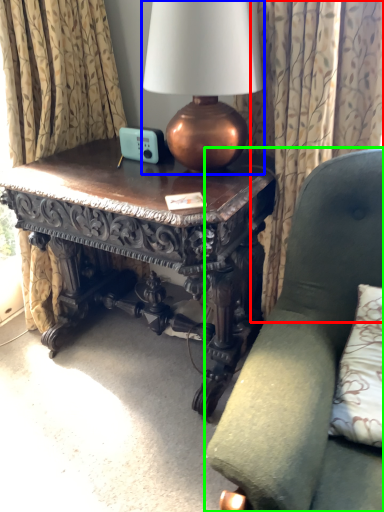
Question: Estimate the real-world distances between objects in this image. Which object is closer to curtain (highlighted by a red box), lamp (highlighted by a blue box) or chair (highlighted by a green box)?

Choices:
 (A) lamp
 (B) chair

Answer: (A)